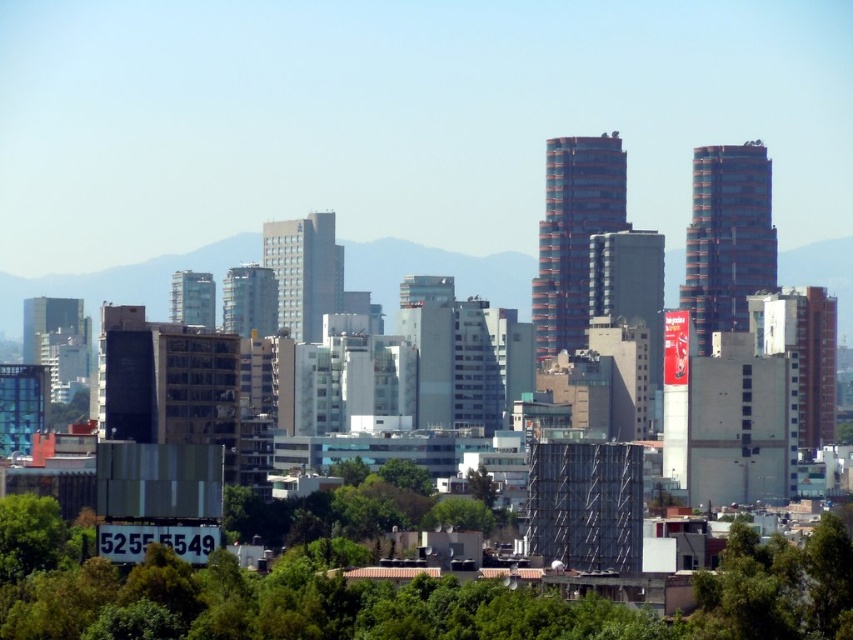
Question: Which point is closer to the camera?

Choices:
 (A) green leafy tree at lower right
 (B) green leafy tree at lower center

Answer: (B)

Question: Does green leafy tree at lower right appear on the right side of green leafy tree at lower center?

Choices:
 (A) yes
 (B) no

Answer: (A)

Question: Which point is farther from the camera taking this photo?

Choices:
 (A) (694, 589)
 (B) (457, 499)

Answer: (A)

Question: Can you confirm if green leafy tree at lower right is thinner than green leafy tree at lower center?

Choices:
 (A) yes
 (B) no

Answer: (A)

Question: Can you confirm if green leafy tree at lower right is smaller than green leafy tree at lower center?

Choices:
 (A) no
 (B) yes

Answer: (B)